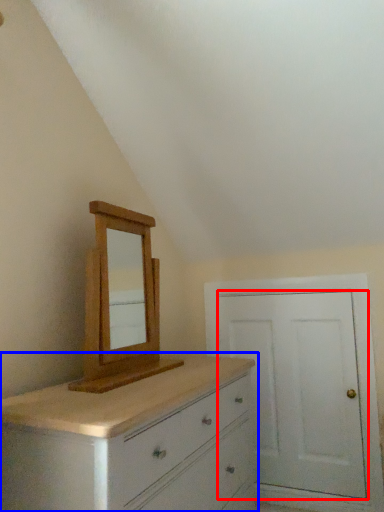
Question: Which object is closer to the camera taking this photo, door (highlighted by a red box) or chest of drawers (highlighted by a blue box)?

Choices:
 (A) door
 (B) chest of drawers

Answer: (B)